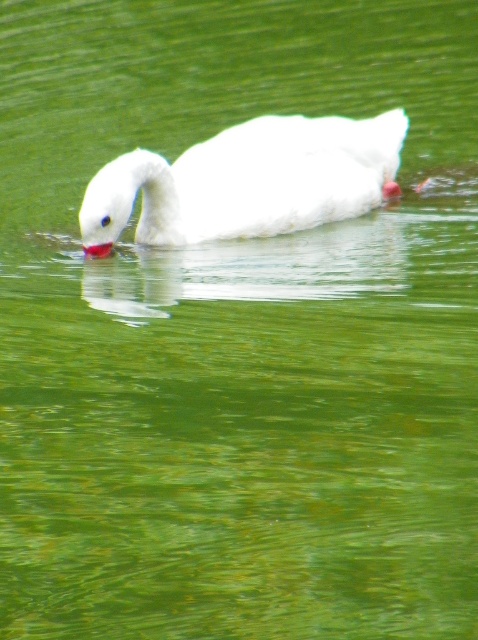
Question: From the image, what is the correct spatial relationship of white matte swan at center in relation to matte red beak at center?

Choices:
 (A) below
 (B) above

Answer: (B)

Question: In this image, where is white matte swan at center located relative to matte red beak at center?

Choices:
 (A) below
 (B) above

Answer: (B)

Question: Which of the following is the farthest from the observer?

Choices:
 (A) white matte swan at center
 (B) matte red beak at center

Answer: (B)

Question: Which point is farther from the camera taking this photo?

Choices:
 (A) (291, 140)
 (B) (97, 248)

Answer: (A)

Question: Can you confirm if white matte swan at center is positioned to the left of matte red beak at center?

Choices:
 (A) no
 (B) yes

Answer: (A)

Question: Which of the following is the farthest from the observer?

Choices:
 (A) matte red beak at center
 (B) white matte swan at center

Answer: (A)